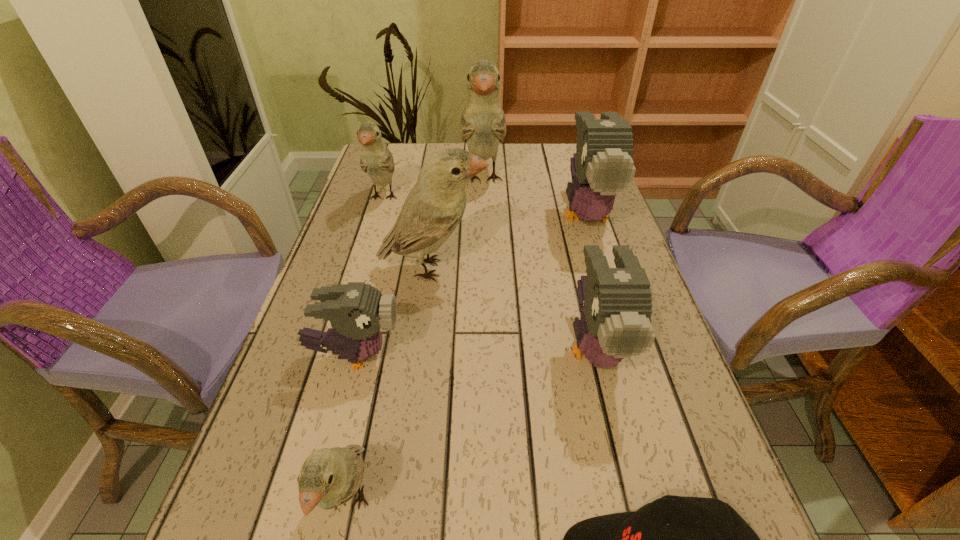
You are a GUI agent. You are given a task and a screenshot of the screen. Output one action in this format:
    pyautogui.click(x=<x>, y=<y>)
    Task: Click on the tallest object
    The width and height of the screenshot is (960, 540).
    Given the screenshot: What is the action you would take?
    pyautogui.click(x=483, y=125)

Where is `the biggest white bird`? the biggest white bird is located at coordinates (483, 125).

At what (x,y) coordinates should I click in order to perform the action: click on the fourth nearest bird. Please return your answer as a coordinate pair (x, y). This screenshot has width=960, height=540. Looking at the image, I should click on point(435,205).

Where is `the third smallest white bird`? Image resolution: width=960 pixels, height=540 pixels. the third smallest white bird is located at coordinates (435, 205).

Locate an element on the screen. the biggest gray bird is located at coordinates (602, 165).

Identify the location of the third biggest white bird. This screenshot has height=540, width=960. (376, 160).

Find the location of a particular element. This screenshot has width=960, height=540. the second biggest gray bird is located at coordinates (615, 323).

Find the location of a particular element. The height and width of the screenshot is (540, 960). the smallest gray bird is located at coordinates (356, 311).

The image size is (960, 540). I want to click on vacant area situated 0.080m at the face of the biggest white bird, so click(483, 225).

Identify the location of free point located at the face of the fourth farthest object. Image resolution: width=960 pixels, height=540 pixels. (594, 268).